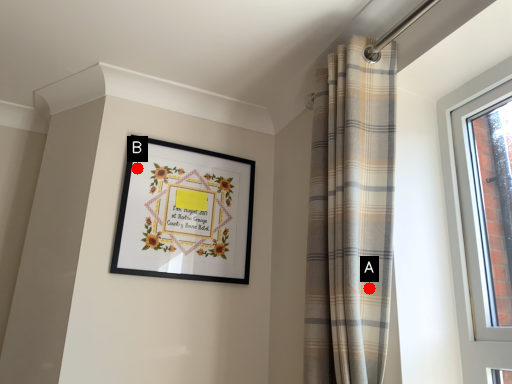
Question: Two points are circled on the image, labeled by A and B beside each circle. Which point is further to the camera?

Choices:
 (A) A is further
 (B) B is further

Answer: (B)